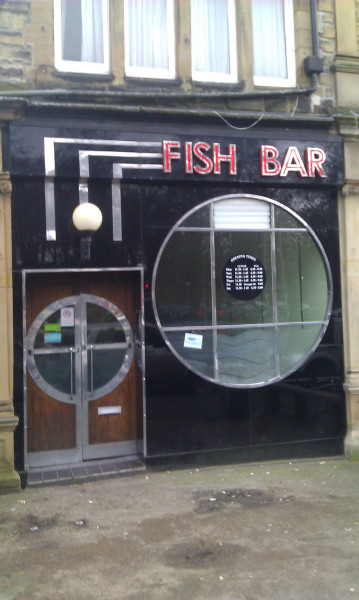
I want to click on round window, so click(x=62, y=369).